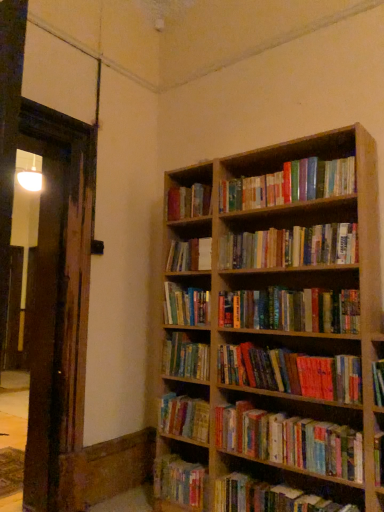
Question: Is hardcover book at lower center, the first book when ordered from bottom to top, not near hardcover books at center, placed as the fifth book when sorted from top to bottom?

Choices:
 (A) no
 (B) yes

Answer: (A)

Question: From the image's perspective, is hardcover book at lower center, the first book when ordered from bottom to top, on top of hardcover books at center, the eighth book when ordered from bottom to top?

Choices:
 (A) yes
 (B) no

Answer: (B)

Question: Is hardcover book at lower center, the 12th book when ordered from top to bottom, closer to the viewer compared to hardcover books at center, the eighth book when ordered from bottom to top?

Choices:
 (A) no
 (B) yes

Answer: (A)

Question: Is the surface of hardcover book at lower center, the first book when ordered from bottom to top, in direct contact with hardcover books at center, the eighth book when ordered from bottom to top?

Choices:
 (A) no
 (B) yes

Answer: (A)

Question: Is hardcover books at center, the eighth book when ordered from bottom to top, at the back of hardcover book at lower center, the first book when ordered from bottom to top?

Choices:
 (A) yes
 (B) no

Answer: (B)

Question: From a real-world perspective, is hardcover book at lower center, the 12th book when ordered from top to bottom, located higher than hardcover books at center, the eighth book when ordered from bottom to top?

Choices:
 (A) no
 (B) yes

Answer: (A)

Question: From a real-world perspective, is hardcover books at center, which ranks as the tenth book in bottom-to-top order, located beneath hardcover book at lower right, which is the eleventh book in top-to-bottom order?

Choices:
 (A) yes
 (B) no

Answer: (B)

Question: Is hardcover books at center, the third book from the top, facing away from hardcover book at lower right, arranged as the second book when ordered from the bottom?

Choices:
 (A) yes
 (B) no

Answer: (B)

Question: From a real-world perspective, is hardcover books at center, which ranks as the tenth book in bottom-to-top order, over hardcover book at lower right, which is the eleventh book in top-to-bottom order?

Choices:
 (A) no
 (B) yes

Answer: (B)

Question: Can you see hardcover books at center, which ranks as the tenth book in bottom-to-top order, touching hardcover book at lower right, which is the eleventh book in top-to-bottom order?

Choices:
 (A) no
 (B) yes

Answer: (A)

Question: Does hardcover books at center, which ranks as the tenth book in bottom-to-top order, appear on the left side of hardcover book at lower right, which is the eleventh book in top-to-bottom order?

Choices:
 (A) no
 (B) yes

Answer: (A)

Question: Does hardcover books at center, the third book from the top, have a greater width compared to hardcover book at lower right, arranged as the second book when ordered from the bottom?

Choices:
 (A) yes
 (B) no

Answer: (B)

Question: Is hardcover books at center, which ranks as the tenth book in bottom-to-top order, smaller than hardcover books at center, which is the eighth book from top to bottom?

Choices:
 (A) no
 (B) yes

Answer: (A)